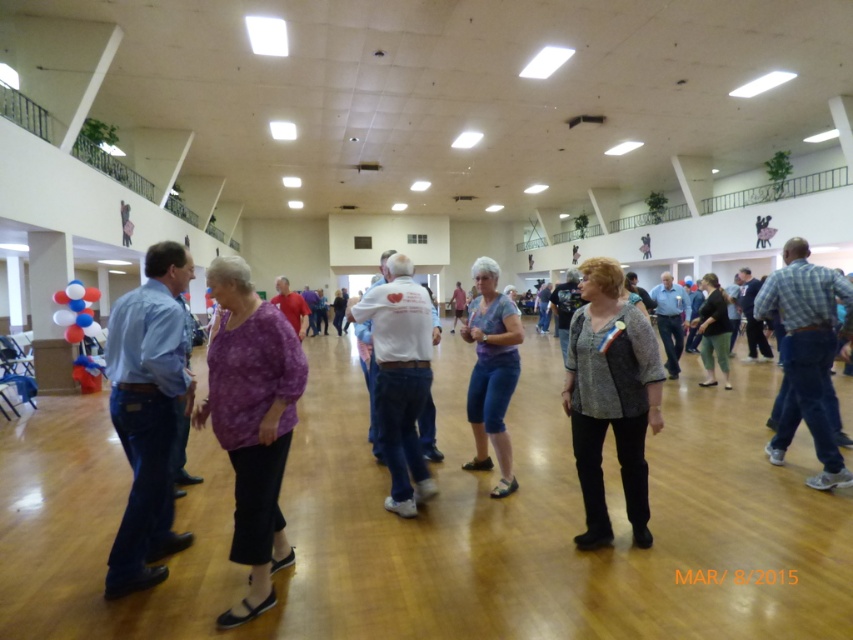
You are a photographer at the dance event and want to capture both the blue denim jeans at left and the white cotton shirt at center in a single frame. Since you can adjust the camera focus, which object should you focus on first if you want to ensure the smaller one is sharp?

The blue denim jeans at left is smaller in size compared to the white cotton shirt at center. To ensure the smaller object is sharp, focus on the blue denim jeans at left first.

You are a photographer positioned at the back of the hall. You want to take a photo of both the blue denim jeans at left and the gray textured sweater at center. Since you can only focus on one object at a time, which object should you focus on first to ensure the other is still in the frame?

Since the blue denim jeans at left is taller than the gray textured sweater at center, you should focus on the blue denim jeans at left first. This ensures that the shorter gray textured sweater at center remains within the frame as well.